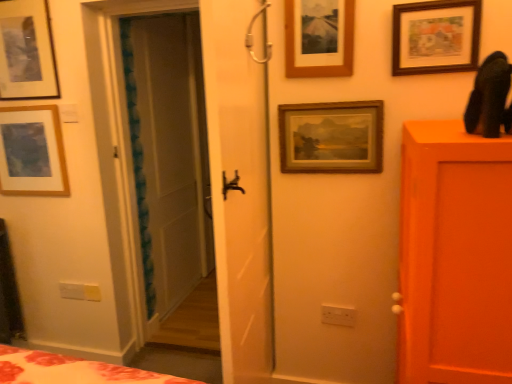
Question: In which direction should I rotate to look at wooden picture frame at upper center, which is counted as the third picture frame, starting from the right?

Choices:
 (A) right
 (B) left

Answer: (A)

Question: Does wooden picture frame at upper center, which is counted as the third picture frame, starting from the right, have a smaller size compared to wooden picture frame at upper right, which is counted as the 5th picture frame, starting from the left?

Choices:
 (A) yes
 (B) no

Answer: (B)

Question: Is the position of wooden picture frame at upper center, which is counted as the third picture frame, starting from the right, less distant than that of wooden picture frame at upper right, which is counted as the 5th picture frame, starting from the left?

Choices:
 (A) no
 (B) yes

Answer: (A)

Question: Considering the relative sizes of wooden picture frame at upper center, which is the third picture frame in left-to-right order, and wooden picture frame at upper right, which is counted as the 5th picture frame, starting from the left, in the image provided, is wooden picture frame at upper center, which is the third picture frame in left-to-right order, taller than wooden picture frame at upper right, which is counted as the 5th picture frame, starting from the left,?

Choices:
 (A) yes
 (B) no

Answer: (A)

Question: From a real-world perspective, does wooden picture frame at upper center, which is the third picture frame in left-to-right order, stand above wooden picture frame at upper right, which is counted as the 1th picture frame, starting from the right?

Choices:
 (A) yes
 (B) no

Answer: (A)

Question: Is wooden picture frame at upper center, which is counted as the third picture frame, starting from the right, bigger than wooden picture frame at upper right, which is counted as the 1th picture frame, starting from the right?

Choices:
 (A) no
 (B) yes

Answer: (B)

Question: Is wooden picture frame at upper center, which is the third picture frame in left-to-right order, completely or partially outside of wooden picture frame at upper right, which is counted as the 5th picture frame, starting from the left?

Choices:
 (A) yes
 (B) no

Answer: (A)

Question: Is wooden picture frame at upper center, which is the third picture frame in left-to-right order, closer to camera compared to matte wooden picture frame at upper left, which ranks as the 5th picture frame in right-to-left order?

Choices:
 (A) no
 (B) yes

Answer: (B)

Question: From a real-world perspective, is wooden picture frame at upper center, which is counted as the third picture frame, starting from the right, physically above matte wooden picture frame at upper left, which ranks as the 5th picture frame in right-to-left order?

Choices:
 (A) yes
 (B) no

Answer: (A)

Question: From a real-world perspective, is wooden picture frame at upper center, which is the third picture frame in left-to-right order, positioned under matte wooden picture frame at upper left, the 1th picture frame from the left, based on gravity?

Choices:
 (A) yes
 (B) no

Answer: (B)

Question: Is wooden picture frame at upper center, which is the third picture frame in left-to-right order, at the left side of matte wooden picture frame at upper left, the 1th picture frame from the left?

Choices:
 (A) no
 (B) yes

Answer: (A)

Question: Is wooden picture frame at upper center, which is counted as the third picture frame, starting from the right, located outside matte wooden picture frame at upper left, which ranks as the 5th picture frame in right-to-left order?

Choices:
 (A) yes
 (B) no

Answer: (A)

Question: Is wooden picture frame at upper center, which is counted as the third picture frame, starting from the right, not close to matte wooden picture frame at upper left, the 1th picture frame from the left?

Choices:
 (A) no
 (B) yes

Answer: (B)

Question: Is wooden picture frame at upper center, which is the third picture frame in left-to-right order, completely or partially inside wooden picture frame at upper right, which is counted as the 5th picture frame, starting from the left?

Choices:
 (A) no
 (B) yes

Answer: (A)